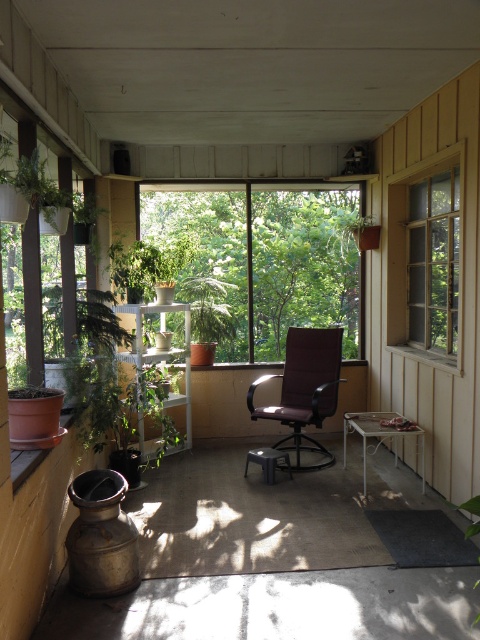
Can you confirm if clear glass window at upper right is wider than purple fabric chair at center?

In fact, clear glass window at upper right might be narrower than purple fabric chair at center.

What do you see at coordinates (427, 259) in the screenshot? The width and height of the screenshot is (480, 640). I see `clear glass window at upper right` at bounding box center [427, 259].

Where is `clear glass window at upper right`? clear glass window at upper right is located at coordinates (427, 259).

Who is lower down, transparent glass window at center or green matte plant at left?

green matte plant at left is lower down.

Which is in front, point (342, 310) or point (60, 348)?

Point (60, 348) is more forward.

Between point (328, 323) and point (107, 316), which one is positioned behind?

Point (328, 323)

This screenshot has height=640, width=480. In order to click on transparent glass window at center in this screenshot , I will do `click(265, 259)`.

Between clear glass window at upper right and green matte plant at left, which one appears on the right side from the viewer's perspective?

clear glass window at upper right is more to the right.

Between clear glass window at upper right and green matte plant at left, which one has more height?

Standing taller between the two is clear glass window at upper right.

Identify the location of clear glass window at upper right. (427, 259).

This screenshot has height=640, width=480. Find the location of `clear glass window at upper right`. clear glass window at upper right is located at coordinates (427, 259).